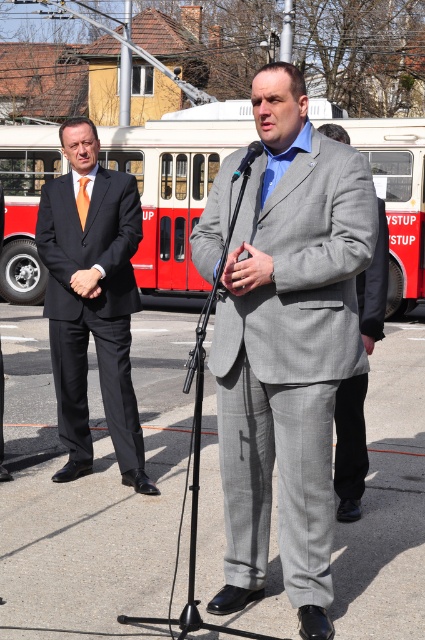
You are organizing a charity event and need to arrange seating for two speakers. The first speaker is wearing the matte black suit at left, and the second speaker is wearing the orange silk tie at center. Since the event requires the taller speaker to stand on a platform, which speaker should you place on the platform?

The matte black suit at left is taller than the orange silk tie at center, so the speaker in the matte black suit at left should be placed on the platform.

You are organizing a charity event and need to ensure that all speakers have appropriately sized suits. Given that the gray wool suit at center belongs to the main speaker and the matte gray suit at center is for the guest speaker, which suit is more suitable for the main speaker based on size?

The gray wool suit at center has a larger size compared to the matte gray suit at center, so it is more suitable for the main speaker.

Based on the photo, you are organizing a formal event and need to arrange seating based on the height of attendees. You have two men wearing the matte black suit at left and the gray wool suit at center. Which one should you seat in the back row to ensure they have a clear view?

The matte black suit at left is taller than the gray wool suit at center, so seating the matte black suit at left in the back row would allow both to have a clear view as the taller individual is placed behind the shorter one.